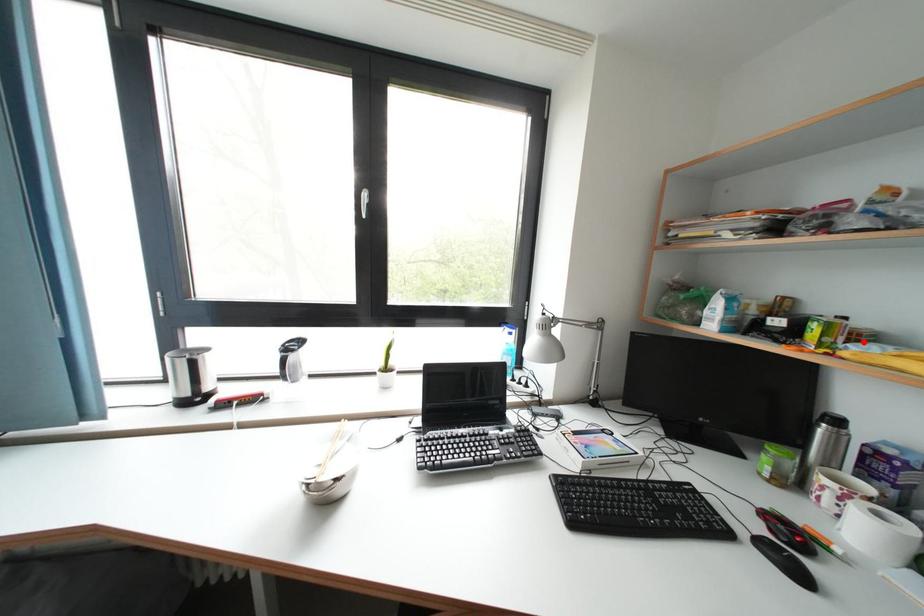
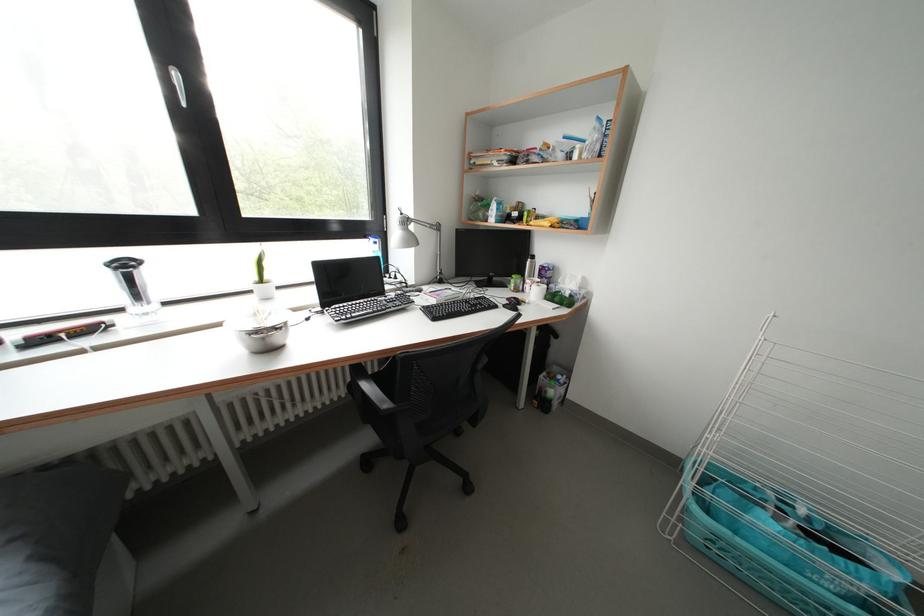
In the second image, find the point that corresponds to the highlighted location in the first image.

(544, 223)